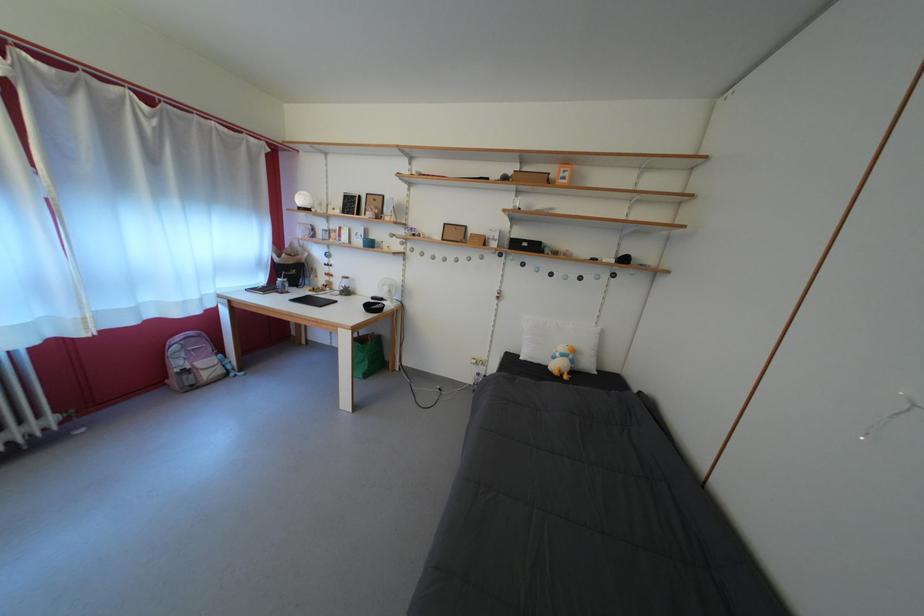
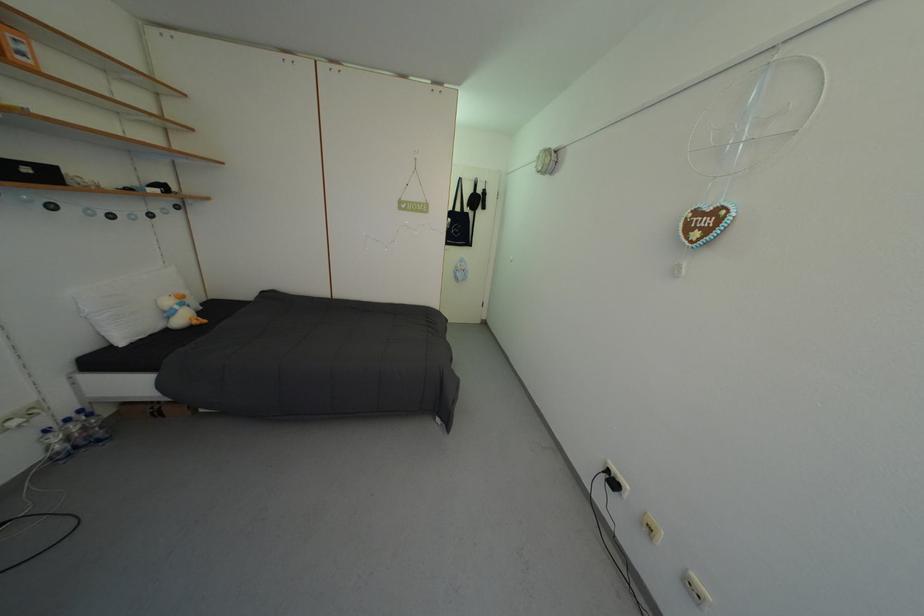
The point at (581, 357) is marked in the first image. Where is the corresponding point in the second image?

(190, 302)